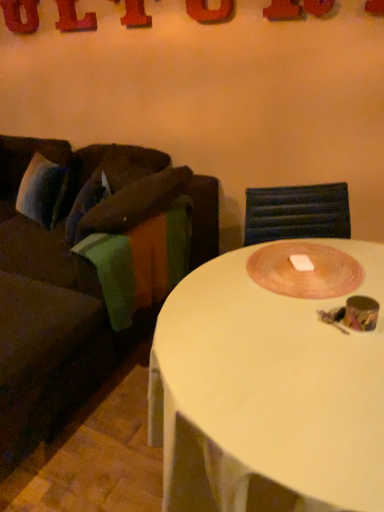
This screenshot has height=512, width=384. Find the location of `free space in front of wooden placemat at center`. free space in front of wooden placemat at center is located at coordinates (282, 345).